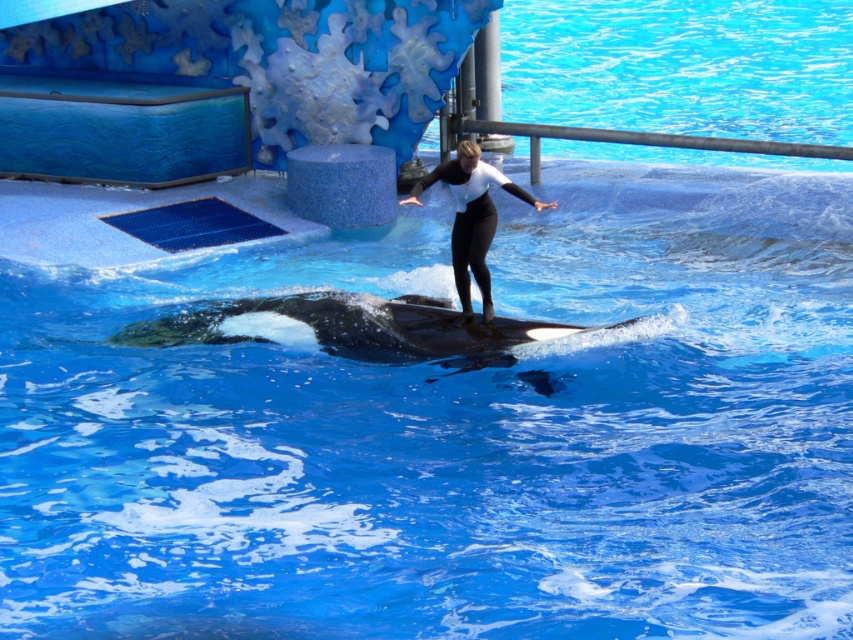
You are a photographer positioned at the edge of the pool. You want to take a photo of the black smooth whale at center and the black matte wetsuit at center. Which object will appear larger in your photo?

The black smooth whale at center will appear larger in the photo because it is closer to the photographer than the black matte wetsuit at center.

You are a marine biologist observing the scene. You need to determine which object occupies more space in the image. Based on the description, which is larger between the black smooth whale at center and the black matte wetsuit at center?

The black smooth whale at center is larger in size than the black matte wetsuit at center, so the whale occupies more space in the image.

In the scene shown: You are a marine biologist observing the orca whale in the marine park. You notice a specific point in the image at coordinates (351, 326). What object does this point correspond to?

The point at coordinates (351, 326) corresponds to the black smooth whale at center.